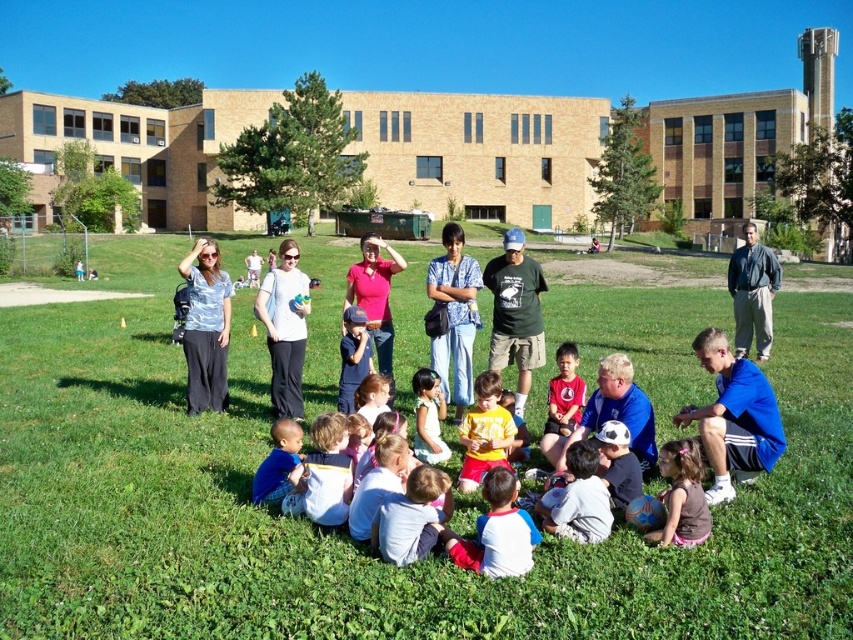
Question: From the image, what is the correct spatial relationship of matte pink shirt at center in relation to matte blue cap at center?

Choices:
 (A) right
 (B) left

Answer: (B)

Question: Estimate the real-world distances between objects in this image. Which object is closer to the matte pink shirt at center?

Choices:
 (A) green grass at center
 (B) smooth pink shirt at center

Answer: (B)

Question: Can you confirm if blue plaid shirt at center is positioned above blue denim shorts at lower left?

Choices:
 (A) no
 (B) yes

Answer: (B)

Question: Based on their relative distances, which object is nearer to the smooth pink shirt at center?

Choices:
 (A) blue plaid shirt at center
 (B) matte blue shirt at center
 (C) pink fabric dress at lower center
 (D) matte blue cap at center

Answer: (A)

Question: Which object is the closest to the gray cotton jacket at right?

Choices:
 (A) yellow matte shirt at center
 (B) matte pink shirt at center
 (C) blue plaid shirt at center
 (D) matte blue cap at center

Answer: (A)

Question: Is smooth pink shirt at center below matte blue cap at center?

Choices:
 (A) yes
 (B) no

Answer: (A)